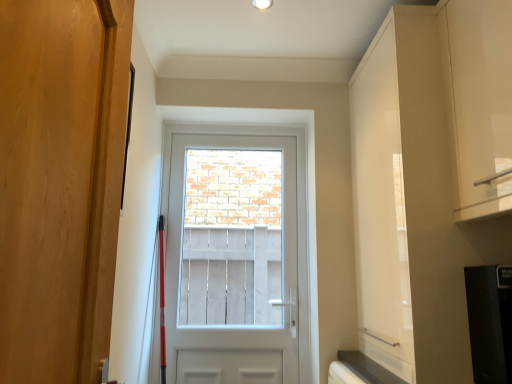
The image size is (512, 384). What do you see at coordinates (429, 179) in the screenshot? I see `white glossy cabinet at upper right` at bounding box center [429, 179].

At what (x,y) coordinates should I click in order to perform the action: click on white glossy cabinet at upper right. Please return your answer as a coordinate pair (x, y). Image resolution: width=512 pixels, height=384 pixels. Looking at the image, I should click on (479, 101).

At what (x,y) coordinates should I click in order to perform the action: click on black matte refrigerator at lower right. Please return your answer as a coordinate pair (x, y). This screenshot has width=512, height=384. Looking at the image, I should click on (490, 322).

Where is `white wooden screen at center`? white wooden screen at center is located at coordinates (231, 238).

Image resolution: width=512 pixels, height=384 pixels. I want to click on white glossy cabinet at upper right, so click(x=429, y=179).

Considering the relative sizes of white glossy cabinet at upper right and white wooden screen at center in the image provided, is white glossy cabinet at upper right smaller than white wooden screen at center?

Incorrect, white glossy cabinet at upper right is not smaller in size than white wooden screen at center.

Is white glossy cabinet at upper right taller or shorter than white wooden screen at center?

Considering their sizes, white glossy cabinet at upper right has less height than white wooden screen at center.

Which is nearer, (410, 143) or (186, 200)?

Point (410, 143).

From a real-world perspective, which object stands above the other?

From a 3D spatial view, white glossy cabinet at upper right is above.

Is the depth of white glossy cabinet at upper right less than that of black matte refrigerator at lower right?

No, white glossy cabinet at upper right is further to the viewer.

From a real-world perspective, is white glossy cabinet at upper right beneath black matte refrigerator at lower right?

No, from a real-world perspective, white glossy cabinet at upper right is not beneath black matte refrigerator at lower right.

Is white glossy cabinet at upper right wider or thinner than black matte refrigerator at lower right?

white glossy cabinet at upper right is wider than black matte refrigerator at lower right.

Which object is further away from the camera taking this photo, white glossy cabinet at upper right or wooden door at left, positioned as the 1th door in front-to-back order?

white glossy cabinet at upper right.

Is white glossy cabinet at upper right turned away from wooden door at left, positioned as the 1th door in front-to-back order?

No, wooden door at left, positioned as the 1th door in front-to-back order, is not at the back of white glossy cabinet at upper right.

Does white glossy cabinet at upper right have a greater width compared to wooden door at left, the second door from the back?

Correct, the width of white glossy cabinet at upper right exceeds that of wooden door at left, the second door from the back.

In the scene shown: Is white glossy cabinet at upper right not inside wooden door at left, the second door from the back?

Absolutely, white glossy cabinet at upper right is external to wooden door at left, the second door from the back.

Based on the photo, does white glossy cabinet at upper right appear on the left side of black matte refrigerator at lower right?

No, white glossy cabinet at upper right is not to the left of black matte refrigerator at lower right.

Where is `appliance that is below the white glossy cabinet at upper right (from the image's perspective)`? appliance that is below the white glossy cabinet at upper right (from the image's perspective) is located at coordinates (490, 322).

Between point (501, 208) and point (486, 330), which one is positioned in front?

Point (501, 208)

Can you tell me how much white glossy cabinet at upper right and black matte refrigerator at lower right differ in facing direction?

0.567 degrees.

From a real-world perspective, is white glossy door at center, the second door from the front, above or below black matte refrigerator at lower right?

white glossy door at center, the second door from the front, is situated higher than black matte refrigerator at lower right in the real world.

In the scene shown: Is white glossy door at center, the first door from the back, touching black matte refrigerator at lower right?

white glossy door at center, the first door from the back, and black matte refrigerator at lower right are not in contact.

Is white glossy door at center, the first door from the back, not inside black matte refrigerator at lower right?

Yes.

Is white wooden screen at center facing away from black matte refrigerator at lower right?

No, black matte refrigerator at lower right is not at the back of white wooden screen at center.

Considering the relative positions of white wooden screen at center and black matte refrigerator at lower right in the image provided, is white wooden screen at center to the left of black matte refrigerator at lower right from the viewer's perspective?

Yes.

Is white wooden screen at center placed right next to black matte refrigerator at lower right?

No, white wooden screen at center is not next to black matte refrigerator at lower right.

At what (x,y) coordinates should I click in order to perform the action: click on appliance in front of the white wooden screen at center. Please return your answer as a coordinate pair (x, y). The height and width of the screenshot is (384, 512). Looking at the image, I should click on (490, 322).

Can you confirm if white wooden screen at center is wider than white glossy cabinet at upper right?

No, white wooden screen at center is not wider than white glossy cabinet at upper right.

Does point (216, 235) come closer to viewer compared to point (496, 187)?

No, (216, 235) is behind (496, 187).

Does white wooden screen at center contain white glossy cabinet at upper right?

No, white glossy cabinet at upper right is not a part of white wooden screen at center.

The width and height of the screenshot is (512, 384). Find the location of `window screen that appears on the left of white glossy cabinet at upper right`. window screen that appears on the left of white glossy cabinet at upper right is located at coordinates coord(231,238).

Identify the location of dresser to the right of white wooden screen at center. The width and height of the screenshot is (512, 384). (429, 179).

I want to click on dresser behind the black matte refrigerator at lower right, so click(x=429, y=179).

Which object lies nearer to the anchor point wooden door at left, the second door from the back, black matte refrigerator at lower right or white glossy cabinet at upper right?

white glossy cabinet at upper right.

Considering their positions, is wooden door at left, positioned as the 1th door in front-to-back order, positioned further to white glossy door at center, the second door from the front, than white glossy cabinet at upper right?

Based on the image, wooden door at left, positioned as the 1th door in front-to-back order, appears to be further to white glossy door at center, the second door from the front.

Considering their positions, is black matte refrigerator at lower right positioned further to white glossy cabinet at upper right than wooden door at left, the second door from the back?

wooden door at left, the second door from the back, is positioned further to the anchor white glossy cabinet at upper right.

Considering their positions, is white glossy door at center, the second door from the front, positioned closer to white wooden screen at center than black matte refrigerator at lower right?

white glossy door at center, the second door from the front, is closer to white wooden screen at center.

Looking at the image, which one is located closer to white wooden screen at center, wooden door at left, the second door from the back, or black matte refrigerator at lower right?

black matte refrigerator at lower right is closer to white wooden screen at center.

From the image, which object appears to be farther from white glossy cabinet at upper right, white glossy cabinet at upper right or black matte refrigerator at lower right?

The object further to white glossy cabinet at upper right is black matte refrigerator at lower right.

When comparing their distances from wooden door at left, positioned as the 1th door in front-to-back order, does white glossy door at center, the first door from the back, or white wooden screen at center seem further?

Among the two, white wooden screen at center is located further to wooden door at left, positioned as the 1th door in front-to-back order.

From the image, which object appears to be farther from white glossy door at center, the first door from the back, white wooden screen at center or black matte refrigerator at lower right?

Among the two, white wooden screen at center is located further to white glossy door at center, the first door from the back.

The image size is (512, 384). What are the coordinates of `dresser between wooden door at left, positioned as the 1th door in front-to-back order, and white glossy cabinet at upper right` in the screenshot? It's located at (429, 179).

Find the location of a particular element. The width and height of the screenshot is (512, 384). dresser positioned between white glossy cabinet at upper right and white glossy door at center, the first door from the back, from near to far is located at coordinates (429, 179).

This screenshot has width=512, height=384. I want to click on dresser between black matte refrigerator at lower right and white wooden screen at center along the z-axis, so click(x=429, y=179).

Image resolution: width=512 pixels, height=384 pixels. In order to click on cabinetry between wooden door at left, positioned as the 1th door in front-to-back order, and white wooden screen at center, along the z-axis in this screenshot , I will do `click(479, 101)`.